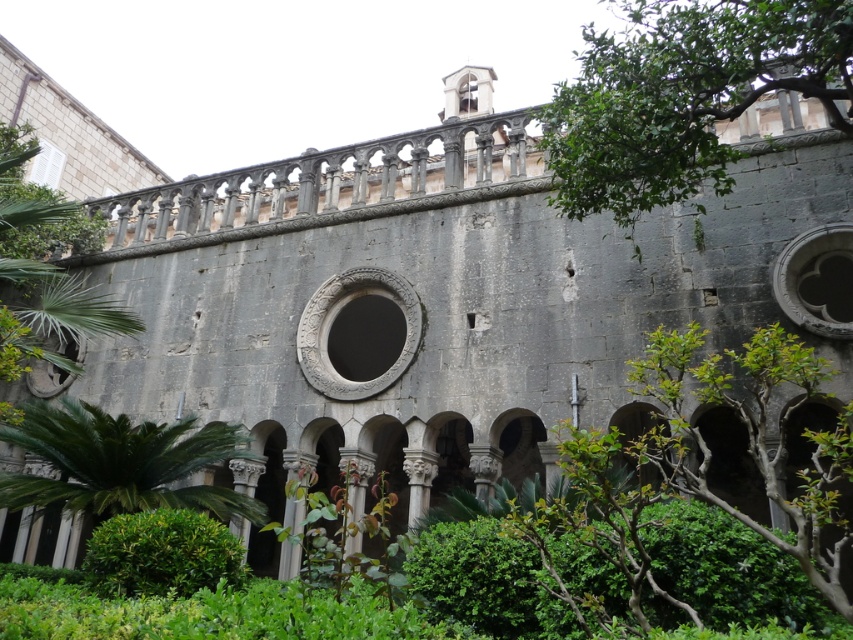
You are standing in front of the historic stone building and notice a point marked at coordinates (683, 97). Based on the scene description, what does this point indicate?

The point at coordinates (683, 97) marks the location of a green leafy tree at upper right.

You are a gardener who needs to trim plants in the monastery garden. You see the green leafy plant at lower left and the green leafy bush at lower center. Which one should you trim first if you want to start with the taller one?

The green leafy plant at lower left is taller than the green leafy bush at lower center, so you should trim the green leafy plant at lower left first.